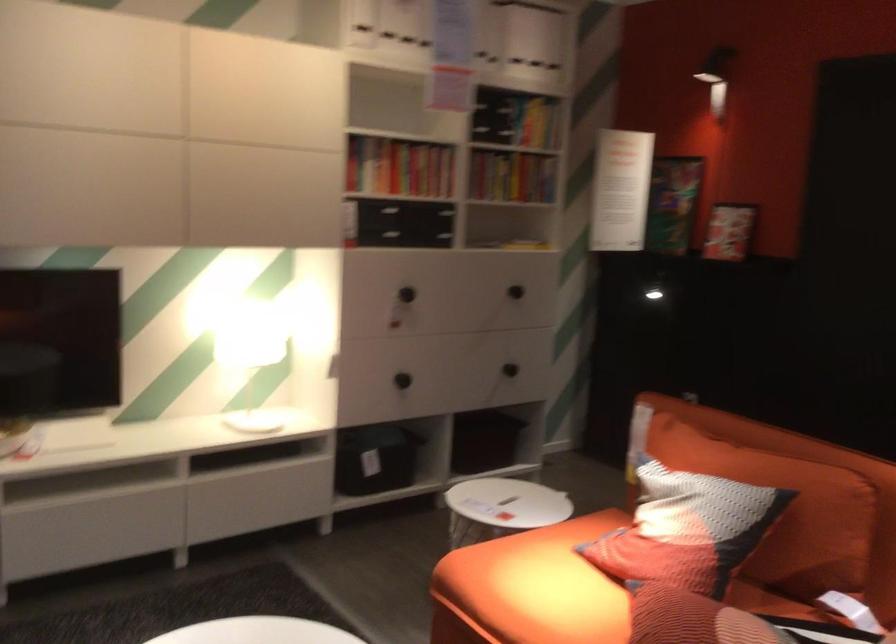
Where is `white table lamp`? white table lamp is located at coordinates (250, 354).